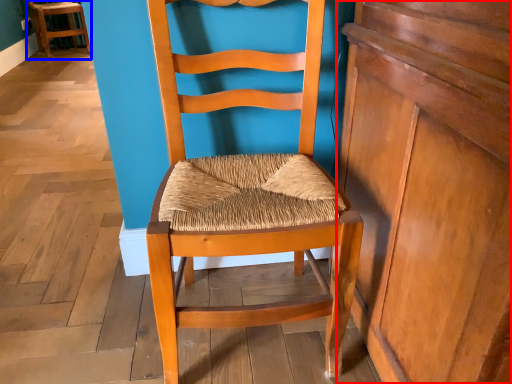
Question: Which object appears closest to the camera in this image, dresser (highlighted by a red box) or chair (highlighted by a blue box)?

Choices:
 (A) dresser
 (B) chair

Answer: (A)